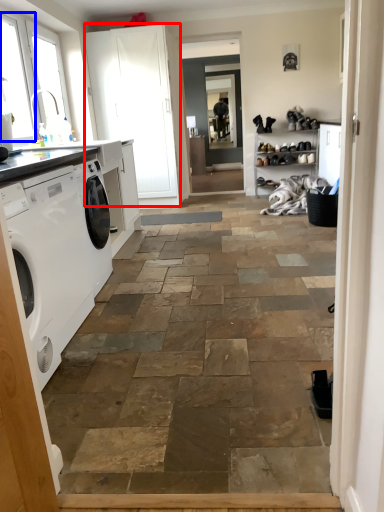
Question: Which object appears closest to the camera in this image, screen door (highlighted by a red box) or window (highlighted by a blue box)?

Choices:
 (A) screen door
 (B) window

Answer: (B)